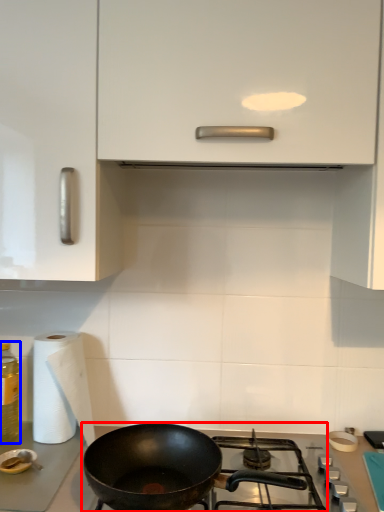
Question: Which point is further to the camera, gas stove (highlighted by a red box) or bottle (highlighted by a blue box)?

Choices:
 (A) gas stove
 (B) bottle

Answer: (B)